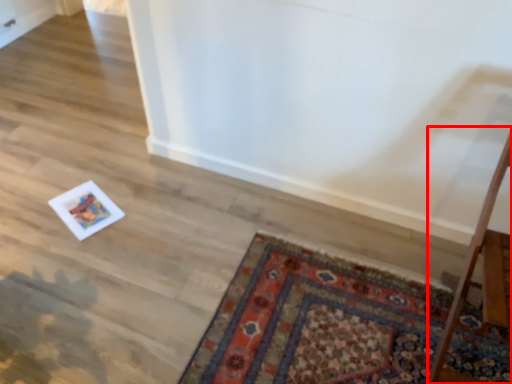
Question: From the image, what is the correct spatial relationship of table (annotated by the red box) in relation to mat?

Choices:
 (A) right
 (B) left

Answer: (A)